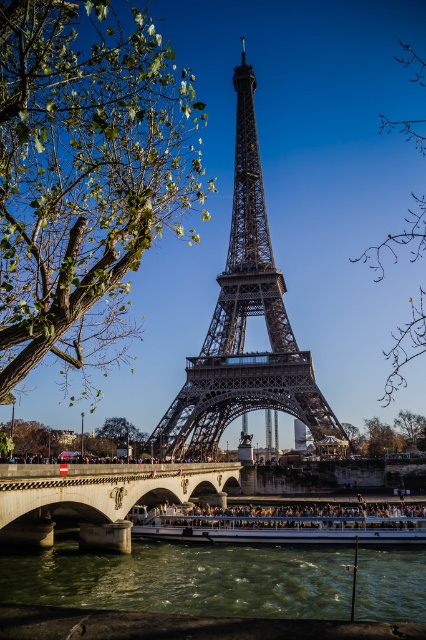
Question: Estimate the real-world distances between objects in this image. Which object is farther from the concrete bridge at center?

Choices:
 (A) white glossy boat at lower center
 (B) green leafy tree at left
 (C) shiny metallic eiffel tower at center

Answer: (B)

Question: Estimate the real-world distances between objects in this image. Which object is farther from the green leafy tree at left?

Choices:
 (A) brown leafy branches at upper right
 (B) concrete bridge at center

Answer: (A)

Question: Does green water at lower center appear under white glossy boat at lower center?

Choices:
 (A) yes
 (B) no

Answer: (A)

Question: Is shiny metallic eiffel tower at center to the right of white glossy boat at lower center from the viewer's perspective?

Choices:
 (A) no
 (B) yes

Answer: (A)

Question: Which of the following is the farthest from the observer?

Choices:
 (A) (63, 225)
 (B) (40, 580)
 (C) (356, 522)

Answer: (A)

Question: From the image, what is the correct spatial relationship of green leafy tree at left in relation to shiny metallic eiffel tower at center?

Choices:
 (A) below
 (B) above

Answer: (B)